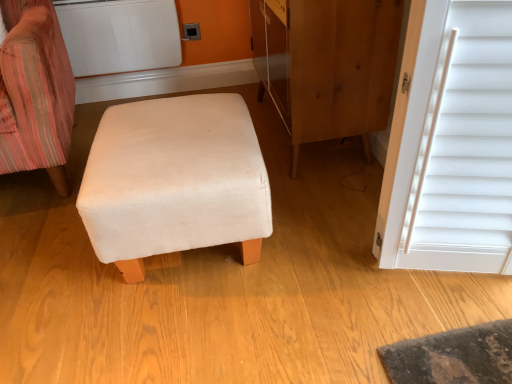
Question: From their relative heights in the image, would you say velvet striped chair at left is taller or shorter than beige fabric ottoman at center?

Choices:
 (A) tall
 (B) short

Answer: (A)

Question: Relative to beige fabric ottoman at center, is velvet striped chair at left in front or behind?

Choices:
 (A) behind
 (B) front

Answer: (A)

Question: Which object is the closest to the velvet striped chair at left?

Choices:
 (A) wooden dresser at center
 (B) matte plastic outlet at upper center
 (C) white matte radiator at upper left
 (D) beige fabric ottoman at center

Answer: (D)

Question: Based on their relative distances, which object is nearer to the beige fabric ottoman at center?

Choices:
 (A) velvet striped chair at left
 (B) matte plastic outlet at upper center
 (C) white matte radiator at upper left
 (D) wooden dresser at center

Answer: (A)